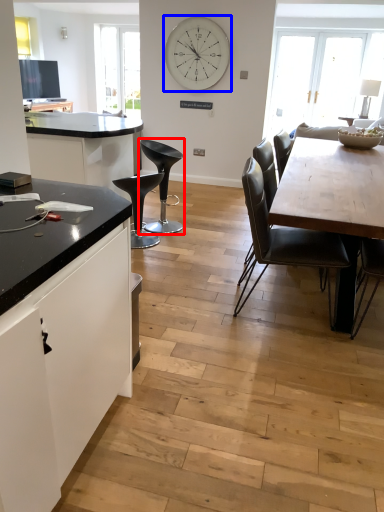
Question: Which of the following is the closest to the observer, chair (highlighted by a red box) or clock (highlighted by a blue box)?

Choices:
 (A) chair
 (B) clock

Answer: (A)